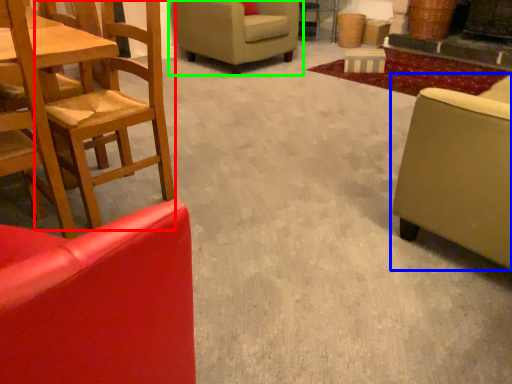
Question: Which object is positioned closest to chair (highlighted by a red box)? Select from studio couch (highlighted by a blue box) and chair (highlighted by a green box).

Choices:
 (A) studio couch
 (B) chair

Answer: (A)